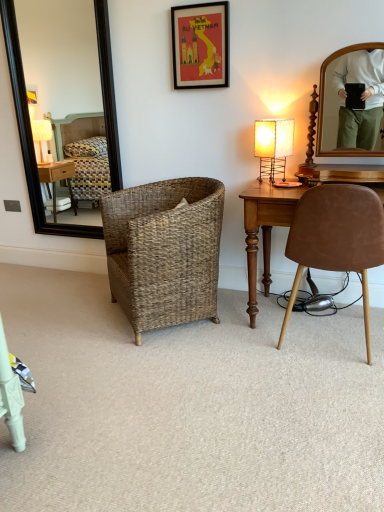
At what (x,y) coordinates should I click in order to perform the action: click on free spot to the left of woven brown basket at center, which ranks as the second chair in right-to-left order. Please return your answer as a coordinate pair (x, y). Looking at the image, I should click on (74, 315).